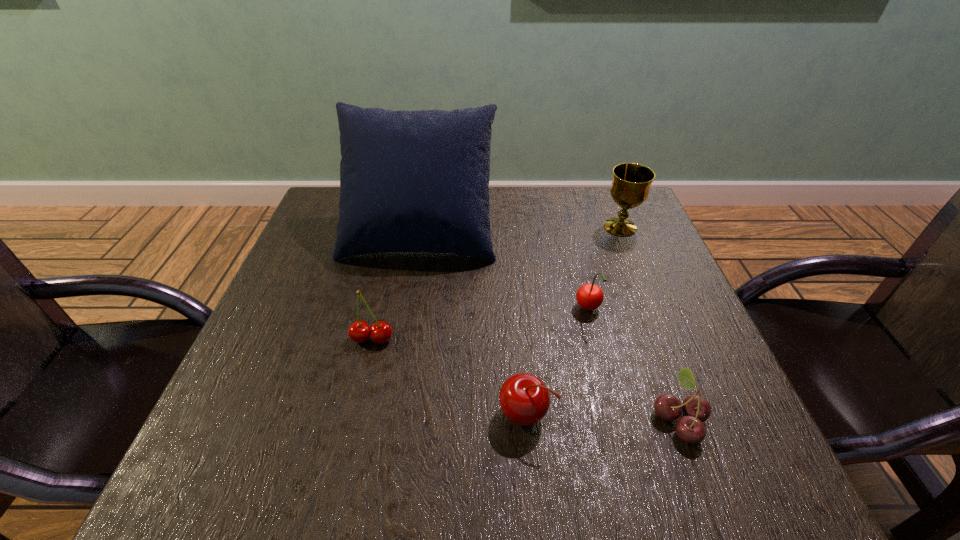
Find the location of `blank space at the far right corner of the desktop`. blank space at the far right corner of the desktop is located at coordinates (593, 195).

This screenshot has height=540, width=960. In order to click on free space that is in between the third cherry from right to left and the tallest object in this screenshot , I will do `click(472, 322)`.

Image resolution: width=960 pixels, height=540 pixels. What are the coordinates of `vacant space in between the chalice and the cushion` in the screenshot? It's located at (520, 229).

Identify the location of vacant space in between the second cherry from left to right and the farthest cherry. (557, 362).

Find the location of a particular element. free space between the tallest object and the shortest cherry is located at coordinates (550, 325).

Locate an element on the screen. vacant point located between the cushion and the third farthest object is located at coordinates (504, 270).

What are the coordinates of `empty location between the cushion and the second cherry from right to left` in the screenshot? It's located at (504, 270).

This screenshot has width=960, height=540. What are the coordinates of `vacant area that lies between the third cherry from right to left and the shortest object` in the screenshot? It's located at (602, 416).

Locate an element on the screen. This screenshot has width=960, height=540. empty location between the second tallest object and the shortest cherry is located at coordinates (650, 322).

The height and width of the screenshot is (540, 960). In order to click on vacant space in between the third cherry from right to left and the leftmost cherry in this screenshot , I will do `click(449, 376)`.